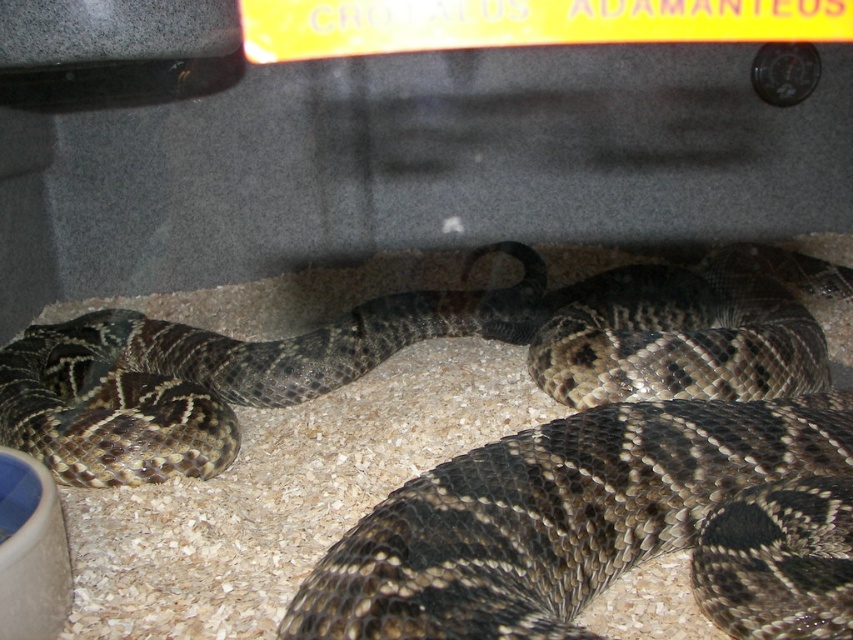
Question: Does shiny brown snake at center lie in front of brown speckled snake at center?

Choices:
 (A) no
 (B) yes

Answer: (B)

Question: Is shiny brown snake at center wider than brown speckled snake at center?

Choices:
 (A) no
 (B) yes

Answer: (B)

Question: Is shiny brown snake at center closer to camera compared to brown speckled snake at center?

Choices:
 (A) yes
 (B) no

Answer: (A)

Question: Which object is farther from the camera taking this photo?

Choices:
 (A) shiny brown snake at center
 (B) brown speckled snake at center

Answer: (B)